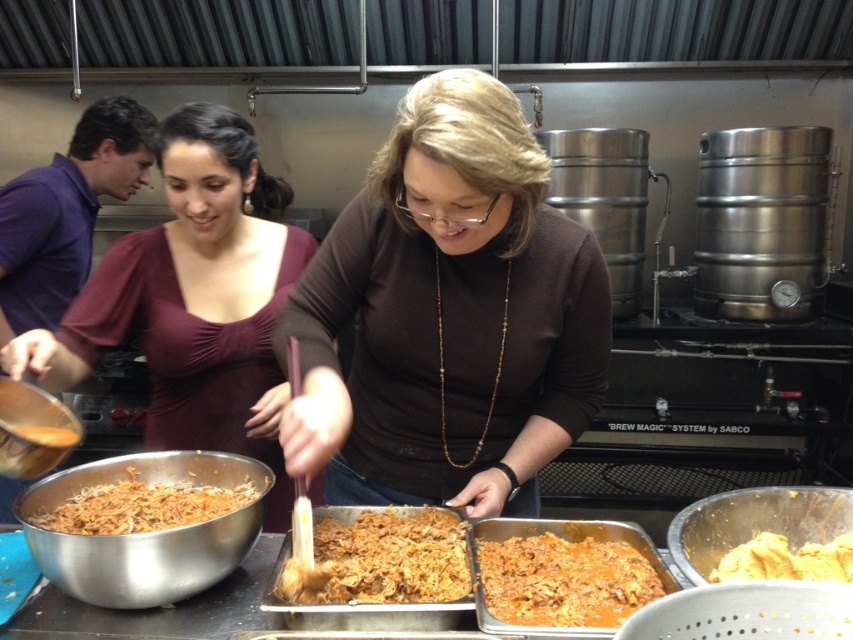
What is the location of the point with coordinates (193, 300) in the image?

The point with coordinates (193, 300) is located on the matte burgundy blouse at center.